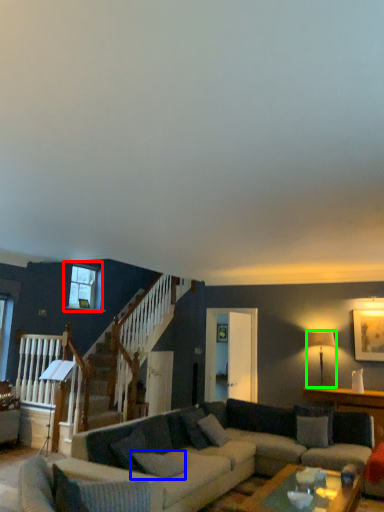
Question: Considering the real-world distances, which object is closest to window (highlighted by a red box)? pillow (highlighted by a blue box) or lamp (highlighted by a green box).

Choices:
 (A) pillow
 (B) lamp

Answer: (A)